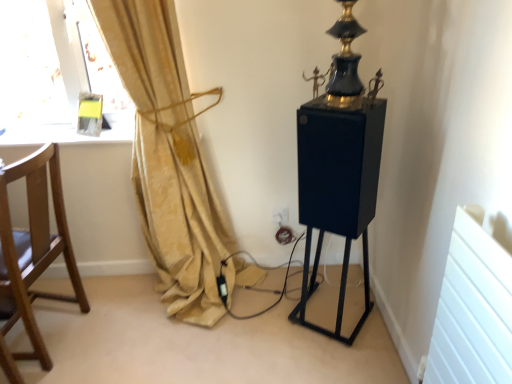
This screenshot has height=384, width=512. I want to click on vacant space to the right of wooden chair at left, so click(x=120, y=350).